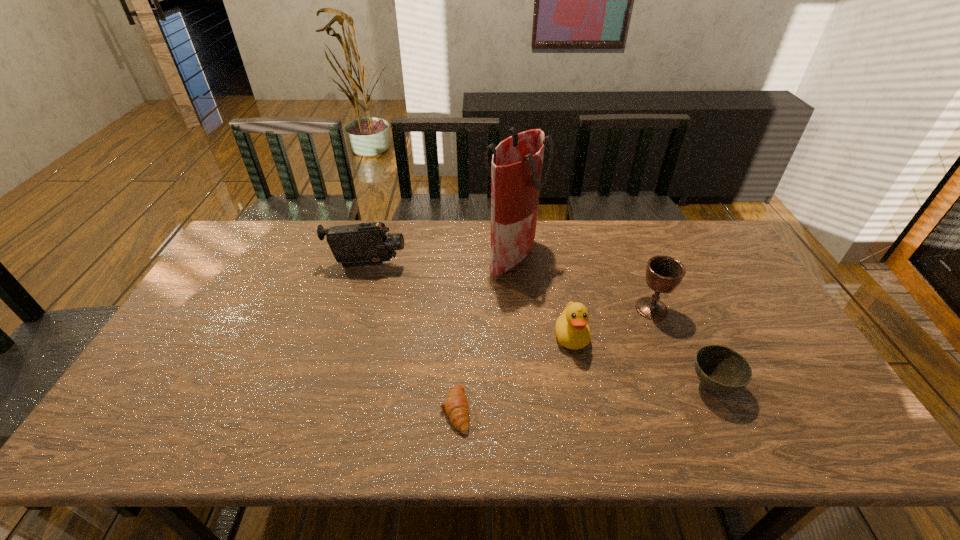
At what (x,y) coordinates should I click in order to perform the action: click on free space at the far left corner. Please return your answer as a coordinate pair (x, y). Looking at the image, I should click on (272, 231).

At what (x,y) coordinates should I click in order to perform the action: click on empty space that is in between the fourth tallest object and the bowl. Please return your answer as a coordinate pair (x, y). The height and width of the screenshot is (540, 960). Looking at the image, I should click on (641, 361).

Find the location of a particular element. The width and height of the screenshot is (960, 540). unoccupied area between the bowl and the leftmost object is located at coordinates (540, 326).

The image size is (960, 540). I want to click on free space between the camcorder and the bowl, so click(540, 326).

Locate an element on the screen. free space that is in between the duck and the leftmost object is located at coordinates (469, 301).

You are a GUI agent. You are given a task and a screenshot of the screen. Output one action in this format:
    pyautogui.click(x=<x>, y=<y>)
    Task: Click on the vacant point located between the camcorder and the chalice
    
    Given the screenshot: What is the action you would take?
    pyautogui.click(x=510, y=287)

Where is `free spot between the crescent roll and the second shortest object`? The image size is (960, 540). free spot between the crescent roll and the second shortest object is located at coordinates (584, 397).

Find the location of `free space between the second shortest object and the fourth tallest object`. free space between the second shortest object and the fourth tallest object is located at coordinates (641, 361).

The width and height of the screenshot is (960, 540). In order to click on vacant area that lies between the leftmost object and the duck in this screenshot , I will do `click(469, 301)`.

The image size is (960, 540). Identify the location of empty space between the tallest object and the chalice. (582, 282).